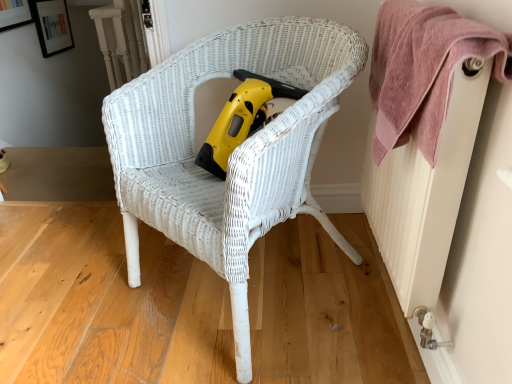
Question: Considering the relative sizes of white textured radiator at right and pink textured towel at upper right in the image provided, is white textured radiator at right smaller than pink textured towel at upper right?

Choices:
 (A) yes
 (B) no

Answer: (B)

Question: From the image's perspective, is white textured radiator at right beneath pink textured towel at upper right?

Choices:
 (A) yes
 (B) no

Answer: (A)

Question: Is white textured radiator at right closer to camera compared to pink textured towel at upper right?

Choices:
 (A) yes
 (B) no

Answer: (A)

Question: Is white textured radiator at right completely or partially outside of pink textured towel at upper right?

Choices:
 (A) no
 (B) yes

Answer: (B)

Question: Are white textured radiator at right and pink textured towel at upper right far apart?

Choices:
 (A) no
 (B) yes

Answer: (A)

Question: In the image, is white textured radiator at right positioned in front of or behind pink textured towel at upper right?

Choices:
 (A) behind
 (B) front

Answer: (B)

Question: Considering the positions of white textured radiator at right and pink textured towel at upper right in the image, is white textured radiator at right wider or thinner than pink textured towel at upper right?

Choices:
 (A) thin
 (B) wide

Answer: (A)

Question: From the image's perspective, is white textured radiator at right located above or below pink textured towel at upper right?

Choices:
 (A) above
 (B) below

Answer: (B)

Question: Choose the correct answer: Is white textured radiator at right inside pink textured towel at upper right or outside it?

Choices:
 (A) inside
 (B) outside

Answer: (A)

Question: From the image's perspective, relative to yellow plastic vacuum at center, is pink textured towel at upper right above or below?

Choices:
 (A) below
 (B) above

Answer: (B)

Question: Is pink textured towel at upper right inside the boundaries of yellow plastic vacuum at center, or outside?

Choices:
 (A) inside
 (B) outside

Answer: (B)

Question: Considering the positions of pink textured towel at upper right and yellow plastic vacuum at center in the image, is pink textured towel at upper right wider or thinner than yellow plastic vacuum at center?

Choices:
 (A) wide
 (B) thin

Answer: (B)

Question: From their relative heights in the image, would you say pink textured towel at upper right is taller or shorter than yellow plastic vacuum at center?

Choices:
 (A) short
 (B) tall

Answer: (B)

Question: From the image's perspective, relative to white wicker chair at center, is yellow plastic vacuum at center above or below?

Choices:
 (A) above
 (B) below

Answer: (A)

Question: Considering the relative positions of yellow plastic vacuum at center and white wicker chair at center in the image provided, is yellow plastic vacuum at center to the left or to the right of white wicker chair at center?

Choices:
 (A) right
 (B) left

Answer: (A)